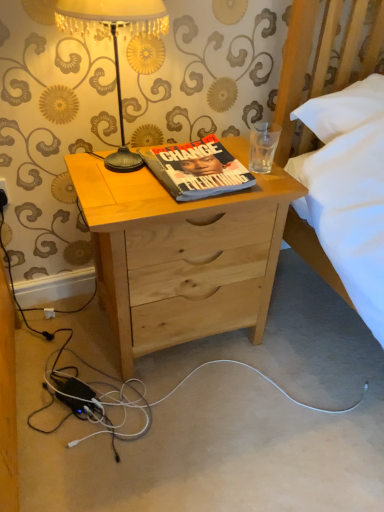
Where is `vacant area situated to the left side of hardcover book at center`? This screenshot has height=512, width=384. vacant area situated to the left side of hardcover book at center is located at coordinates pyautogui.click(x=113, y=176).